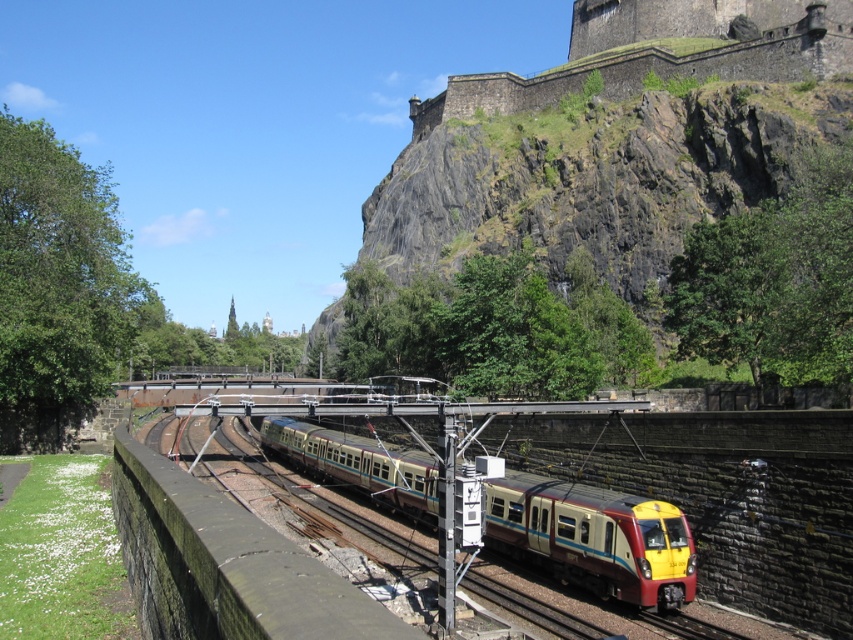
You are a passenger on the yellow polished metal train at center and want to look out the window to see the dark stone wall at upper center. Based on your position inside the train, can you see the wall above you through the window?

Yes, the yellow polished metal train at center is below the dark stone wall at upper center, so passengers inside the train can look up through the window to see the wall above them.

You are a photographer wanting to capture the yellow polished metal train at center and the dark stone wall at upper center in the same frame. Based on their heights, which object would appear smaller in the photo?

The yellow polished metal train at center appears smaller in the photo because it has a lesser height compared to the dark stone wall at upper center.

You are standing at the origin point of the coordinate system, which is the bottom left corner of the image. The yellow polished metal train at center is located at point (595, 538). If you want to walk directly towards the yellow polished metal train at center, in which direction should you move? Please answer with the direction in terms of the coordinate system.

To move towards the yellow polished metal train at center located at coordinates (595, 538) from the origin at the bottom left corner, you should move northeast. This is because the x and y coordinates are both greater than zero, indicating a direction that is both to the right and upwards in the coordinate system.